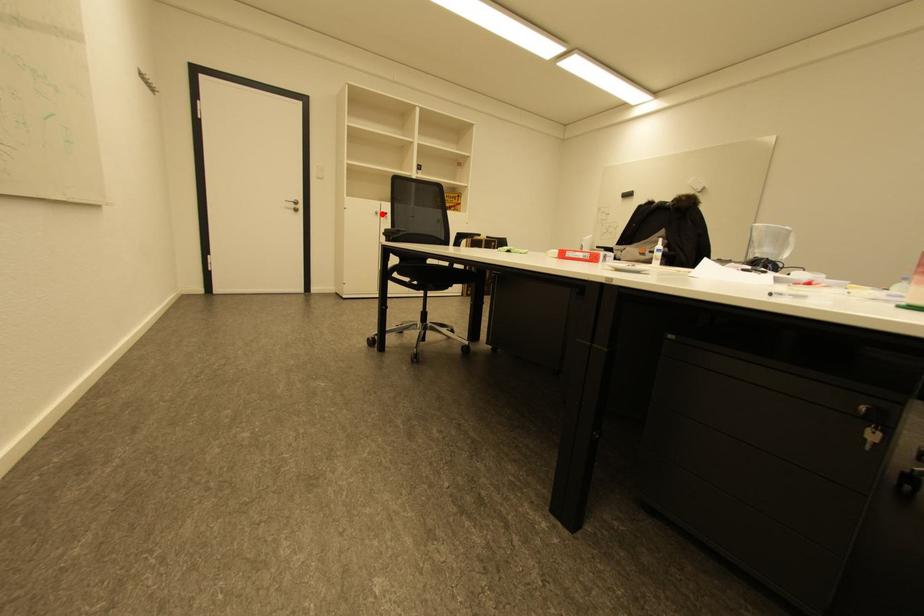
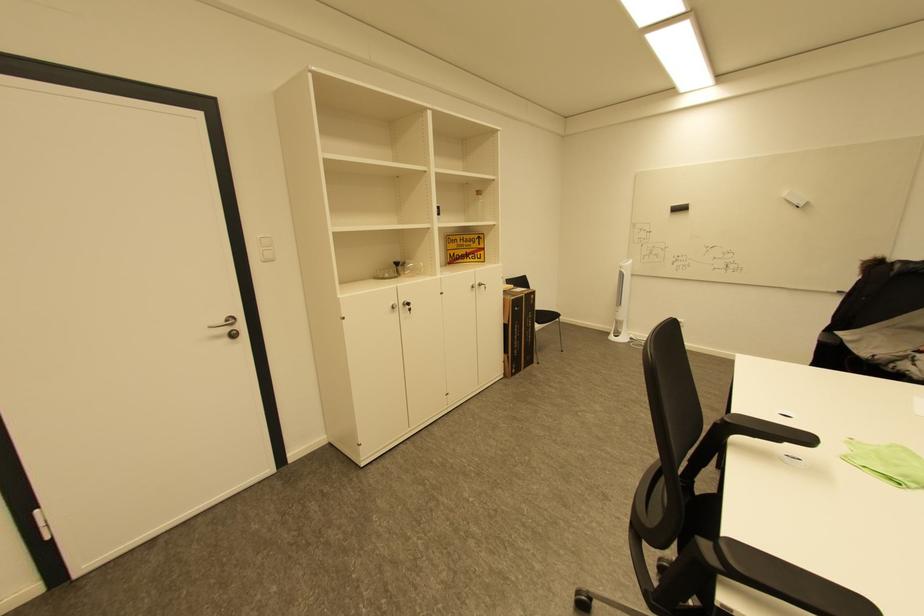
Question: I am providing you with two images of the same scene from different viewpoints. In image1, a red point is highlighted. Considering the same 3D point in image2, which of the following is correct?

Choices:
 (A) It is closer
 (B) It is farther

Answer: (B)